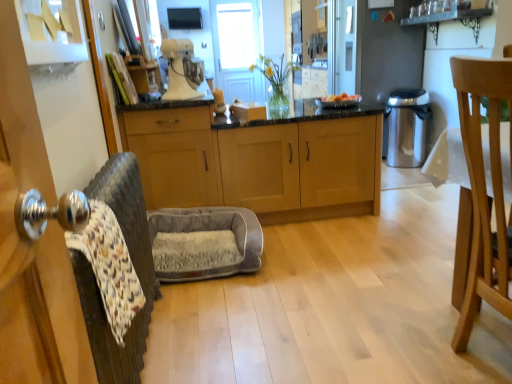
Question: Is light brown wood cabinets at center, positioned as the 2th cabinetry in left-to-right order, in front of light brown wooden chair at right?

Choices:
 (A) yes
 (B) no

Answer: (B)

Question: Is light brown wood cabinets at center, positioned as the 2th cabinetry in left-to-right order, oriented away from light brown wooden chair at right?

Choices:
 (A) yes
 (B) no

Answer: (A)

Question: Does light brown wood cabinets at center, positioned as the 2th cabinetry in left-to-right order, have a lesser height compared to light brown wooden chair at right?

Choices:
 (A) no
 (B) yes

Answer: (B)

Question: Is light brown wood cabinets at center, acting as the first cabinetry starting from the right, positioned behind light brown wooden chair at right?

Choices:
 (A) yes
 (B) no

Answer: (A)

Question: Is light brown wood cabinets at center, positioned as the 2th cabinetry in left-to-right order, not within light brown wooden chair at right?

Choices:
 (A) no
 (B) yes

Answer: (B)

Question: Is white matte stand mixer at upper center inside the boundaries of light brown wood cabinets at center, acting as the first cabinetry starting from the right, or outside?

Choices:
 (A) inside
 (B) outside

Answer: (B)

Question: Considering the relative positions of white matte stand mixer at upper center and light brown wood cabinets at center, positioned as the 2th cabinetry in left-to-right order, in the image provided, is white matte stand mixer at upper center to the left or to the right of light brown wood cabinets at center, positioned as the 2th cabinetry in left-to-right order,?

Choices:
 (A) left
 (B) right

Answer: (A)

Question: Is white matte stand mixer at upper center bigger or smaller than light brown wood cabinets at center, acting as the first cabinetry starting from the right?

Choices:
 (A) small
 (B) big

Answer: (A)

Question: Considering the positions of white matte stand mixer at upper center and light brown wood cabinets at center, acting as the first cabinetry starting from the right, in the image, is white matte stand mixer at upper center wider or thinner than light brown wood cabinets at center, acting as the first cabinetry starting from the right,?

Choices:
 (A) wide
 (B) thin

Answer: (B)

Question: Is gray plush pet bed at center, the 1th swivel chair from the back, wider or thinner than patterned fabric swivel chair at left, the second swivel chair in the back-to-front sequence?

Choices:
 (A) thin
 (B) wide

Answer: (B)

Question: From their relative heights in the image, would you say gray plush pet bed at center, which ranks as the second swivel chair in front-to-back order, is taller or shorter than patterned fabric swivel chair at left, the second swivel chair in the back-to-front sequence?

Choices:
 (A) tall
 (B) short

Answer: (B)

Question: From a real-world perspective, is gray plush pet bed at center, which ranks as the second swivel chair in front-to-back order, physically located above or below patterned fabric swivel chair at left, which is the 1th swivel chair in front-to-back order?

Choices:
 (A) below
 (B) above

Answer: (A)

Question: Based on their sizes in the image, would you say gray plush pet bed at center, which ranks as the second swivel chair in front-to-back order, is bigger or smaller than patterned fabric swivel chair at left, the second swivel chair in the back-to-front sequence?

Choices:
 (A) big
 (B) small

Answer: (A)

Question: Is point (394, 145) closer or farther from the camera than point (232, 155)?

Choices:
 (A) closer
 (B) farther

Answer: (B)

Question: Is stainless steel trash can at right inside the boundaries of light brown wood cabinets at center, acting as the first cabinetry starting from the right, or outside?

Choices:
 (A) inside
 (B) outside

Answer: (B)